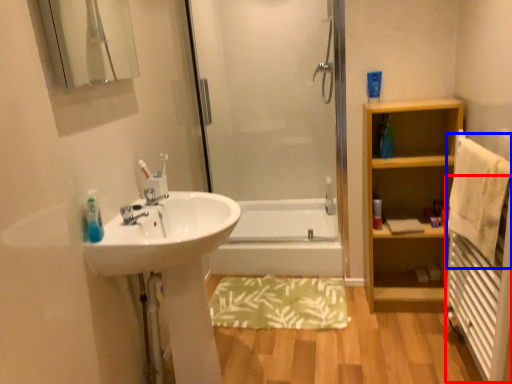
Question: Which object appears farthest to the camera in this image, radiator (highlighted by a red box) or bath towel (highlighted by a blue box)?

Choices:
 (A) radiator
 (B) bath towel

Answer: (B)